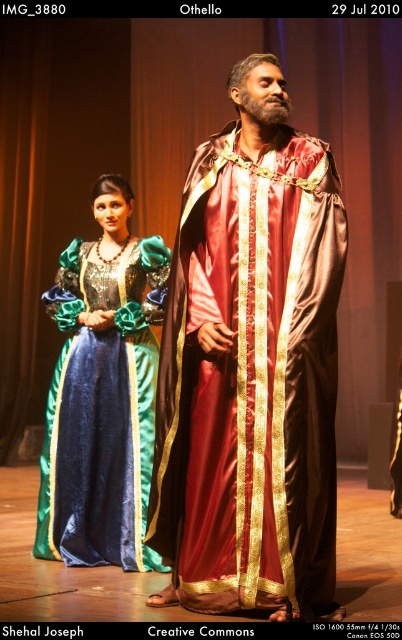
Who is lower down, satin gold robe at center or velvet green dress at center?

velvet green dress at center is lower down.

Which of these two, satin gold robe at center or velvet green dress at center, stands taller?

satin gold robe at center

Does point (178, 435) come behind point (75, 486)?

No.

Locate an element on the screen. satin gold robe at center is located at coordinates (252, 368).